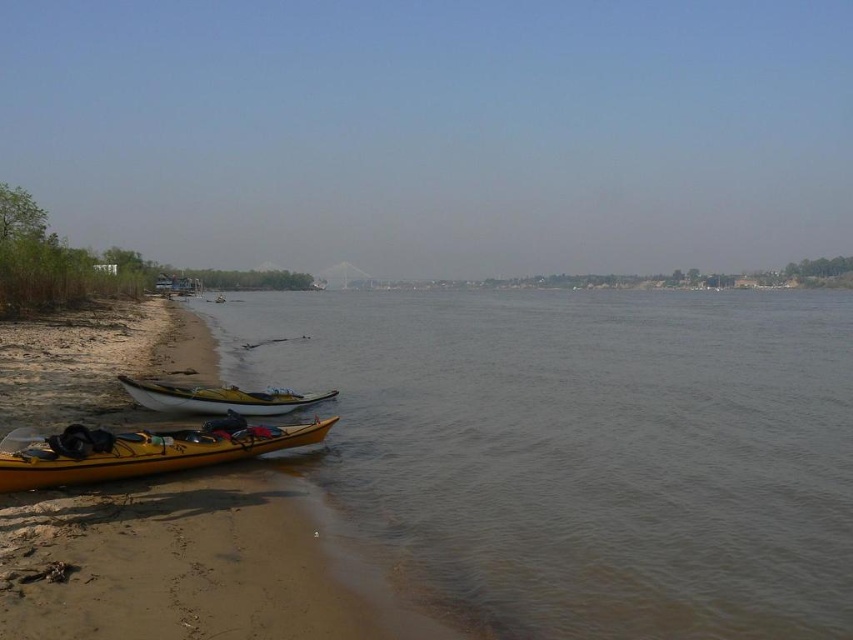
Question: Among these points, which one is nearest to the camera?

Choices:
 (A) (612, 317)
 (B) (283, 390)

Answer: (B)

Question: Which point is closer to the camera taking this photo?

Choices:
 (A) (430, 396)
 (B) (241, 429)
 (C) (200, 406)

Answer: (B)

Question: Is brown matte water at center below white matte canoe at lower left?

Choices:
 (A) yes
 (B) no

Answer: (B)

Question: Can you confirm if yellow matte canoe at lower left is positioned below white matte canoe at lower left?

Choices:
 (A) yes
 (B) no

Answer: (A)

Question: Is yellow matte canoe at lower left in front of white matte canoe at lower left?

Choices:
 (A) no
 (B) yes

Answer: (B)

Question: Among these objects, which one is nearest to the camera?

Choices:
 (A) brown matte water at center
 (B) white matte canoe at lower left

Answer: (A)